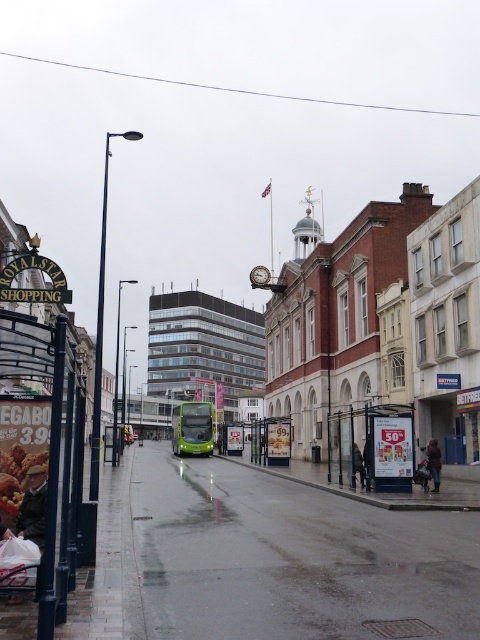
Question: Which object is the closest to the green metallic bus at center?

Choices:
 (A) metallic signboard at left
 (B) green glass bus at center
 (C) concrete pavement at lower left

Answer: (B)

Question: Is concrete pavement at lower left smaller than metallic signboard at left?

Choices:
 (A) yes
 (B) no

Answer: (B)

Question: Which of the following is the closest to the observer?

Choices:
 (A) (206, 433)
 (B) (72, 486)
 (C) (388, 410)
 (D) (226, 508)

Answer: (B)

Question: Does concrete pavement at lower left have a greater width compared to green glass bus at center?

Choices:
 (A) no
 (B) yes

Answer: (B)

Question: Among these points, which one is farthest from the camera?

Choices:
 (A) (383, 468)
 (B) (194, 433)
 (C) (69, 429)
 (D) (287, 611)

Answer: (B)

Question: Can you confirm if concrete pavement at lower left is wider than green metallic bus at center?

Choices:
 (A) no
 (B) yes

Answer: (A)